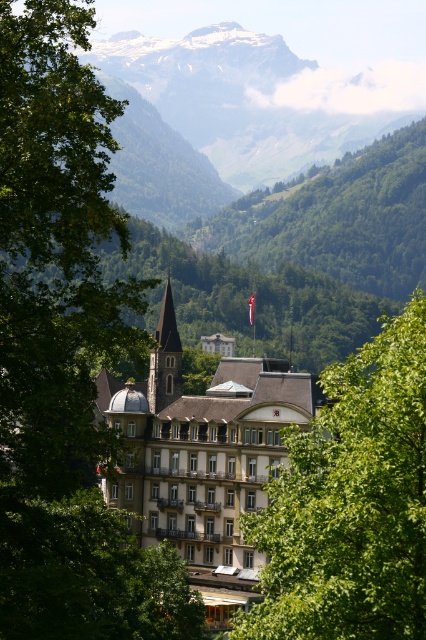
You are standing in the valley looking at the building. Which object, the green leafy tree at center or the green grassy mountain at upper center, is taller?

The green leafy tree at center is shorter than the green grassy mountain at upper center, so the mountain is taller.

You are standing in a valley and see the large classical building with a spire. There are two green leafy trees in front of it. Which tree, the green leafy tree at left or the green leafy tree at center, is closer to you?

The green leafy tree at left is closer to you because it is positioned over the green leafy tree at center, indicating it is in front.

You are standing at the point with coordinates point (374, 417) and want to see the point (80, 371). Can you see it directly without moving your position?

No, because point (80, 371) is behind point (374, 417), so it is obstructed from your current position.